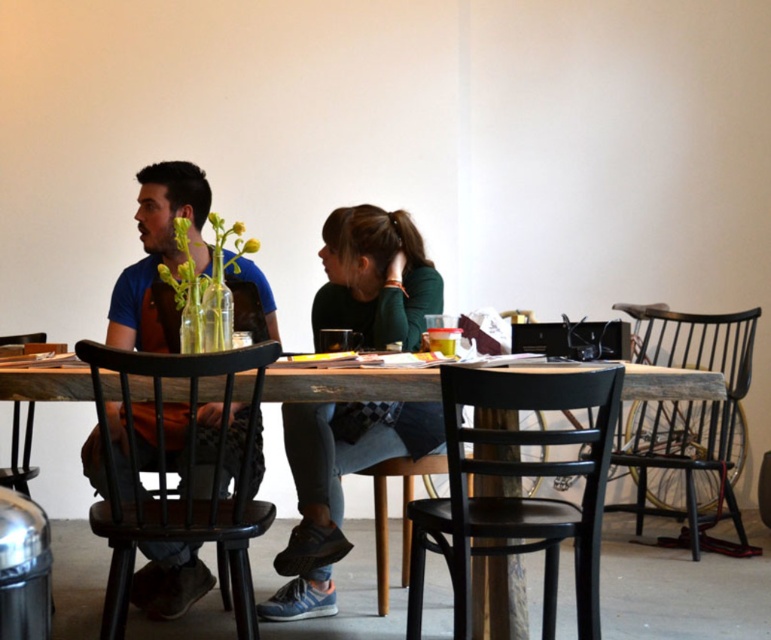
Question: Is matte green sweater at center wider than matte blue shirt at left?

Choices:
 (A) yes
 (B) no

Answer: (B)

Question: Among these objects, which one is farthest from the camera?

Choices:
 (A) reclaimed wood table at center
 (B) matte green sweater at center
 (C) matte blue shirt at left

Answer: (B)

Question: Among these objects, which one is nearest to the camera?

Choices:
 (A) matte green sweater at center
 (B) matte black stool at center

Answer: (A)

Question: Where is reclaimed wood table at center located in relation to matte black stool at center in the image?

Choices:
 (A) above
 (B) below

Answer: (A)

Question: Can you confirm if matte green sweater at center is positioned above matte black stool at center?

Choices:
 (A) no
 (B) yes

Answer: (B)

Question: Among these points, which one is farthest from the camera?

Choices:
 (A) (364, 472)
 (B) (177, 412)

Answer: (A)